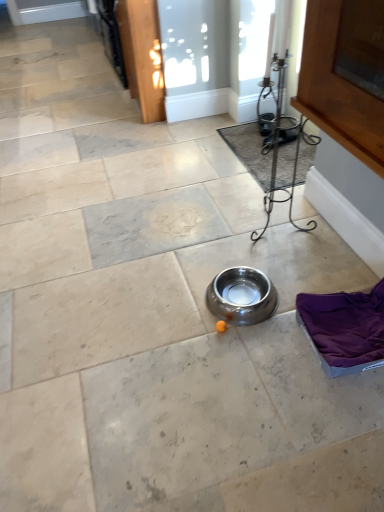
In order to click on vacant space in front of silver metallic bowl at center in this screenshot , I will do `click(242, 350)`.